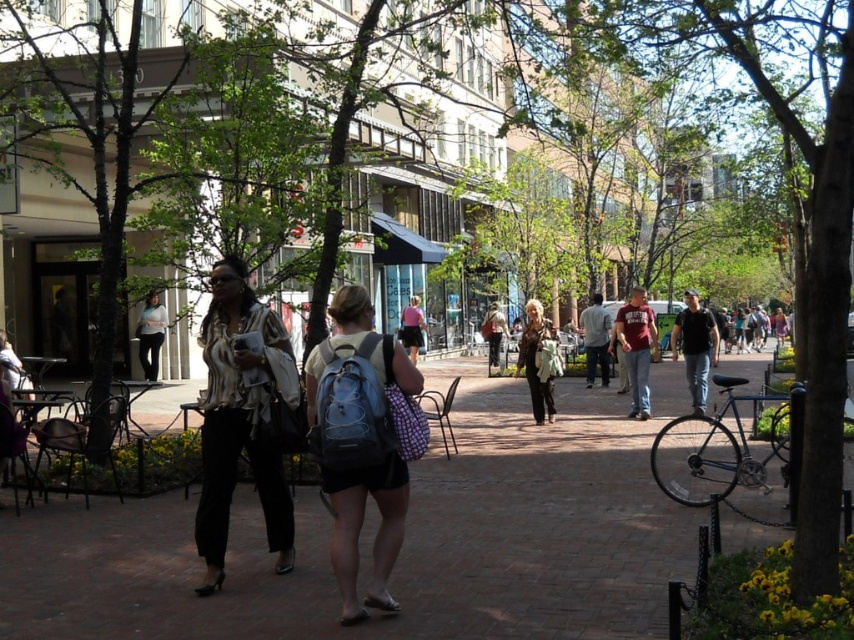
You are a delivery person trying to locate a package left at point (240, 419). According to the scene description, what object is located at that coordinate?

The object at point (240, 419) is matte black pants at left.

Based on the photo, you are a fashion designer observing two jackets in an urban setting. You notice the leather jacket at center and the matte black jacket at center. Which jacket is positioned lower in the image?

The leather jacket at center is positioned lower than the matte black jacket at center.

You are standing at the point marked as point (680, 532) in the image. You want to walk to the nearest coffee shop located 10 meters away from your current position. Can you safely walk in a straight line from your current position to the coffee shop without crossing any obstacles? Please explain your reasoning based on the scene description provided.

The point (680, 532) is 7.06 meters away from the viewer. Since the coffee shop is 10 meters away from the point, the total distance from the viewer to the coffee shop would be 17.06 meters. However, the scene description mentions two women walking in the foreground and trees lining the area. There might be obstacles like trees or pedestrians in the path, so a straight line might not be safe. The answer cannot be definitively confirmed without more details about the path between the point and the coffee.